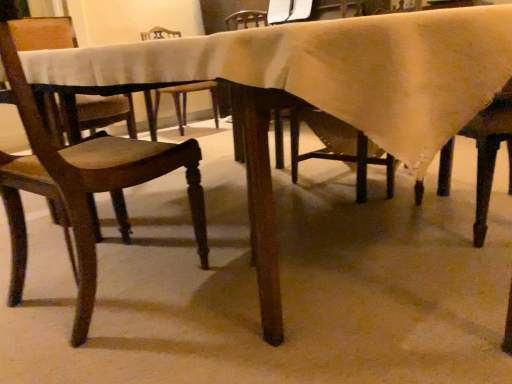
Image resolution: width=512 pixels, height=384 pixels. What are the coordinates of `wooden chair at left` in the screenshot? It's located at (82, 186).

This screenshot has height=384, width=512. What do you see at coordinates (82, 186) in the screenshot?
I see `wooden chair at left` at bounding box center [82, 186].

What is the approximate height of wooden chair at left?

32.24 inches.

What is the approximate width of wooden chair at left?

wooden chair at left is 52.08 centimeters wide.

Locate an element on the screen. wooden chair at left is located at coordinates click(x=82, y=186).